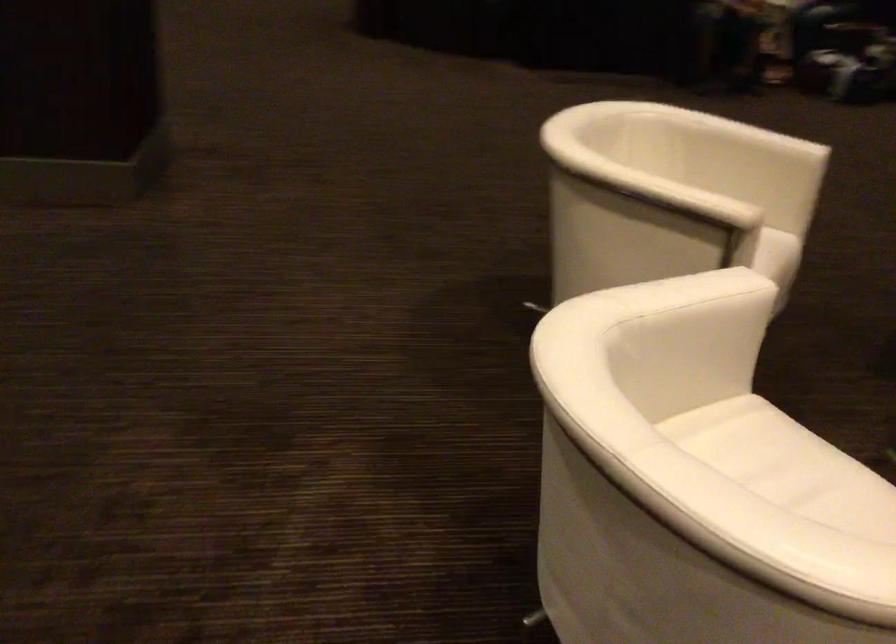
Find the location of `white chair sitting surface`. white chair sitting surface is located at coordinates (767, 453).